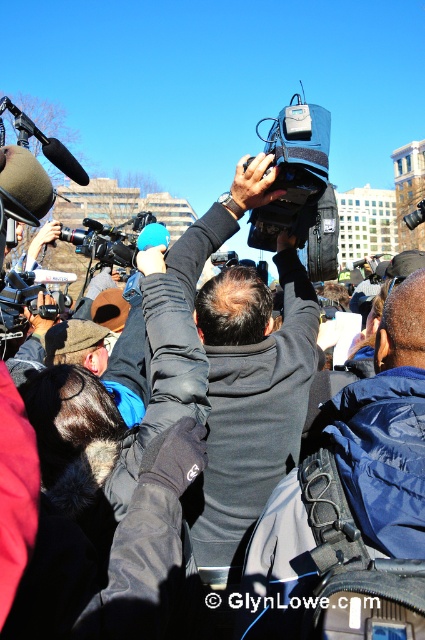
Can you confirm if black matte video camera at upper center is wider than black plastic video camera at upper left?

Yes, black matte video camera at upper center is wider than black plastic video camera at upper left.

Can you confirm if black matte video camera at upper center is bigger than black plastic video camera at upper left?

Yes, black matte video camera at upper center is bigger than black plastic video camera at upper left.

This screenshot has width=425, height=640. What are the coordinates of `black matte video camera at upper center` in the screenshot? It's located at (300, 188).